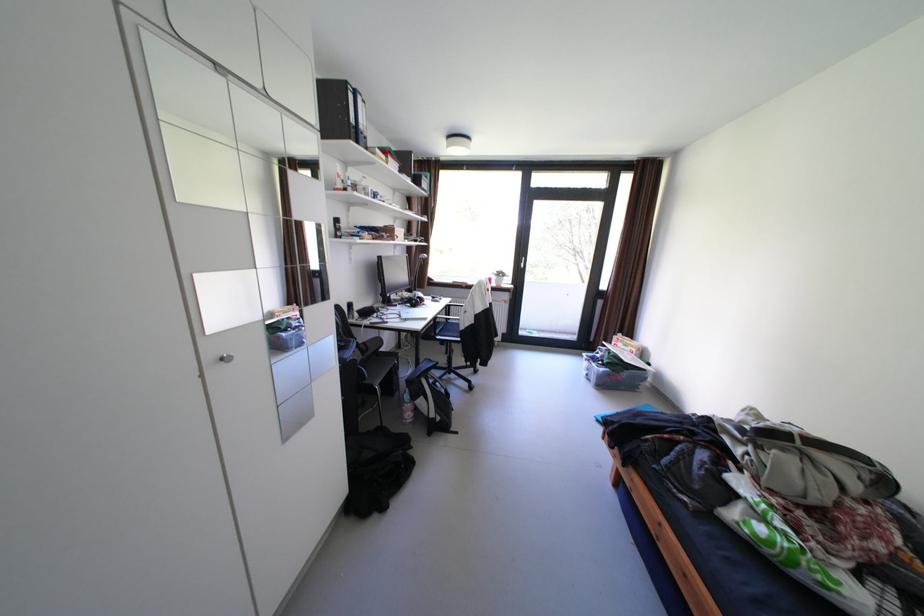
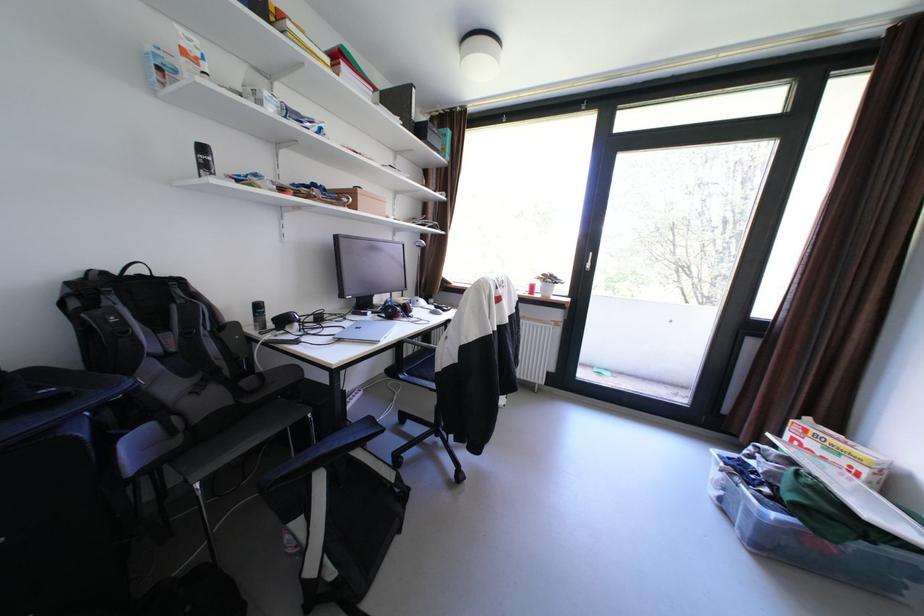
Question: In a continuous first-person perspective shot, in which direction is the camera moving?

Choices:
 (A) Left
 (B) Right
 (C) Forward
 (D) Backward

Answer: (C)